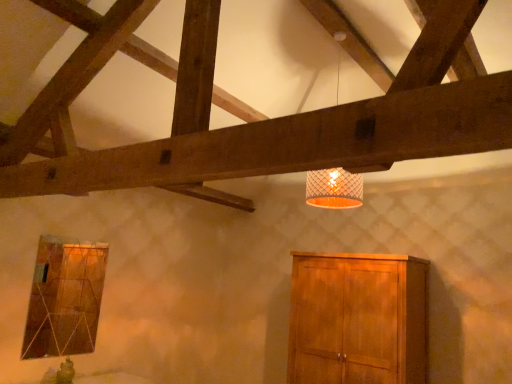
The image size is (512, 384). What do you see at coordinates (357, 319) in the screenshot? I see `wooden cabinet at lower right` at bounding box center [357, 319].

Identify the location of wooden cabinet at lower right. The width and height of the screenshot is (512, 384). (357, 319).

Find the location of a particular element. Image resolution: width=512 pixels, height=384 pixels. wooden cabinet at lower right is located at coordinates (357, 319).

From the image's perspective, is matte glass window at lower left located beneath white mesh lampshade at upper center?

Indeed, from the image's perspective, matte glass window at lower left is shown beneath white mesh lampshade at upper center.

Is matte glass window at lower left closer to the viewer compared to white mesh lampshade at upper center?

No, it is behind white mesh lampshade at upper center.

Is matte glass window at lower left positioned far away from white mesh lampshade at upper center?

Yes.

From the picture: How different are the orientations of matte glass window at lower left and white mesh lampshade at upper center in degrees?

The angular difference between matte glass window at lower left and white mesh lampshade at upper center is 88.5 degrees.

Is point (318, 202) closer to camera compared to point (49, 279)?

Yes, point (318, 202) is in front of point (49, 279).

The image size is (512, 384). I want to click on lamp located above the matte glass window at lower left (from the image's perspective), so click(334, 189).

Are white mesh lampshade at upper center and matte glass window at lower left located far from each other?

Absolutely, white mesh lampshade at upper center is distant from matte glass window at lower left.

Is wooden cabinet at lower right taller or shorter than white mesh lampshade at upper center?

wooden cabinet at lower right is shorter than white mesh lampshade at upper center.

From the image's perspective, which is below, wooden cabinet at lower right or white mesh lampshade at upper center?

wooden cabinet at lower right appears lower in the image.

Are wooden cabinet at lower right and white mesh lampshade at upper center beside each other?

No, wooden cabinet at lower right is not in contact with white mesh lampshade at upper center.

Is wooden cabinet at lower right wider than white mesh lampshade at upper center?

Yes.

Which of these two, white mesh lampshade at upper center or wooden cabinet at lower right, stands shorter?

wooden cabinet at lower right is shorter.

From the image's perspective, between white mesh lampshade at upper center and wooden cabinet at lower right, which one is located above?

From the image's view, white mesh lampshade at upper center is above.

Based on their sizes in the image, would you say white mesh lampshade at upper center is bigger or smaller than wooden cabinet at lower right?

Considering their sizes, white mesh lampshade at upper center takes up less space than wooden cabinet at lower right.

Does point (358, 190) come farther from viewer compared to point (377, 296)?

No, (358, 190) is in front of (377, 296).

Is wooden cabinet at lower right facing towards matte glass window at lower left?

No, wooden cabinet at lower right is not oriented towards matte glass window at lower left.

From the image's perspective, is wooden cabinet at lower right under matte glass window at lower left?

Yes.

At what (x,y) coordinates should I click in order to perform the action: click on cupboard on the right of matte glass window at lower left. Please return your answer as a coordinate pair (x, y). Looking at the image, I should click on (357, 319).

Consider the image. Based on their sizes in the image, would you say matte glass window at lower left is bigger or smaller than wooden cabinet at lower right?

Considering their sizes, matte glass window at lower left takes up less space than wooden cabinet at lower right.

Can you confirm if matte glass window at lower left is wider than wooden cabinet at lower right?

In fact, matte glass window at lower left might be narrower than wooden cabinet at lower right.

Considering the sizes of objects matte glass window at lower left and wooden cabinet at lower right in the image provided, who is taller, matte glass window at lower left or wooden cabinet at lower right?

wooden cabinet at lower right.

From a real-world perspective, who is located lower, matte glass window at lower left or wooden cabinet at lower right?

In real-world perspective, wooden cabinet at lower right is lower.

I want to click on window located on the left of white mesh lampshade at upper center, so click(x=64, y=298).

Where is `window lying behind the white mesh lampshade at upper center`? window lying behind the white mesh lampshade at upper center is located at coordinates (64, 298).

Based on their spatial positions, is matte glass window at lower left or wooden cabinet at lower right further from white mesh lampshade at upper center?

Among the two, matte glass window at lower left is located further to white mesh lampshade at upper center.

From the image, which object appears to be nearer to wooden cabinet at lower right, matte glass window at lower left or white mesh lampshade at upper center?

white mesh lampshade at upper center lies closer to wooden cabinet at lower right than the other object.

Estimate the real-world distances between objects in this image. Which object is closer to matte glass window at lower left, wooden cabinet at lower right or white mesh lampshade at upper center?

wooden cabinet at lower right.

When comparing their distances from white mesh lampshade at upper center, does wooden cabinet at lower right or matte glass window at lower left seem further?

matte glass window at lower left.

Based on their spatial positions, is white mesh lampshade at upper center or wooden cabinet at lower right closer to matte glass window at lower left?

The object closer to matte glass window at lower left is wooden cabinet at lower right.

When comparing their distances from wooden cabinet at lower right, does white mesh lampshade at upper center or matte glass window at lower left seem further?

matte glass window at lower left lies further to wooden cabinet at lower right than the other object.

You are a GUI agent. You are given a task and a screenshot of the screen. Output one action in this format:
    pyautogui.click(x=<x>, y=<y>)
    Task: Click on the lamp located between matte glass window at lower left and wooden cabinet at lower right in the left-right direction
    The width and height of the screenshot is (512, 384).
    Given the screenshot: What is the action you would take?
    pyautogui.click(x=334, y=189)